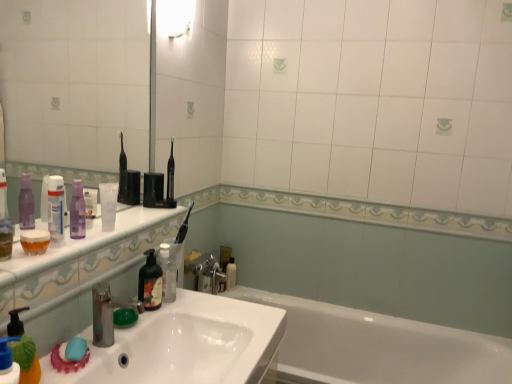
What are the coordinates of `vacant space behind purple matte bottle at left, the fourth toiletry positioned from the bottom` in the screenshot? It's located at (121, 225).